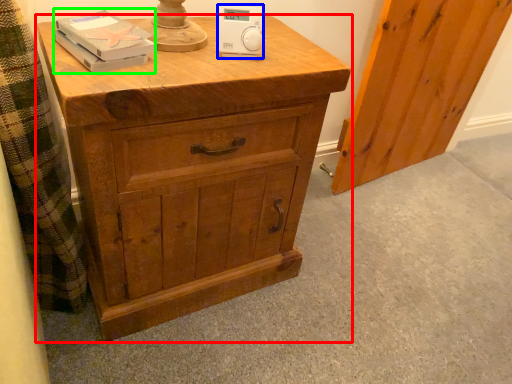
Question: Which is farther away from chest of drawers (highlighted by a red box)? ipod (highlighted by a blue box) or book (highlighted by a green box)?

Choices:
 (A) ipod
 (B) book

Answer: (A)